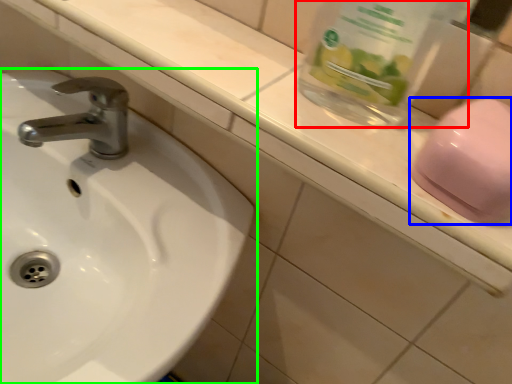
Question: Which object is the farthest from glass jar (highlighted by a red box)? Choose among these: soap (highlighted by a blue box) or sink (highlighted by a green box).

Choices:
 (A) soap
 (B) sink

Answer: (B)